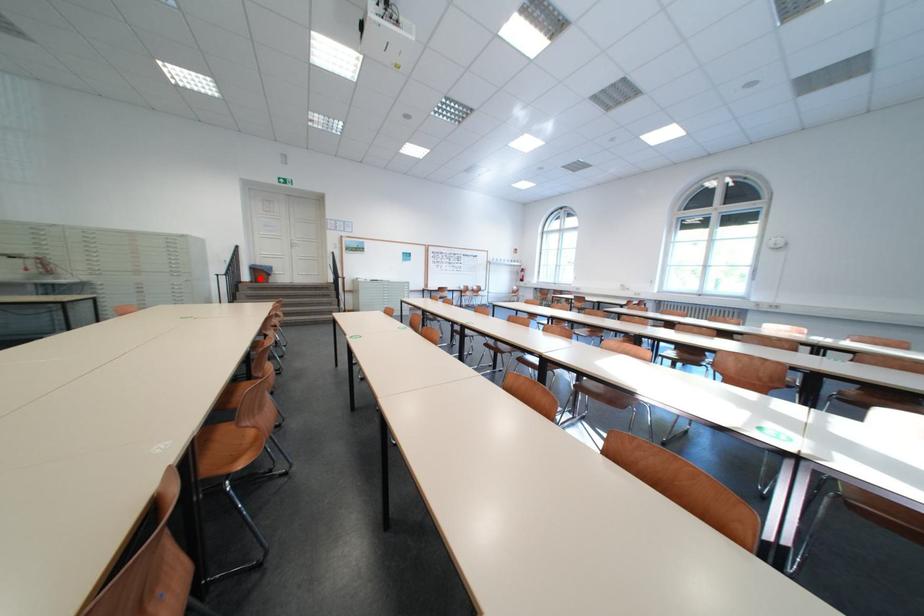
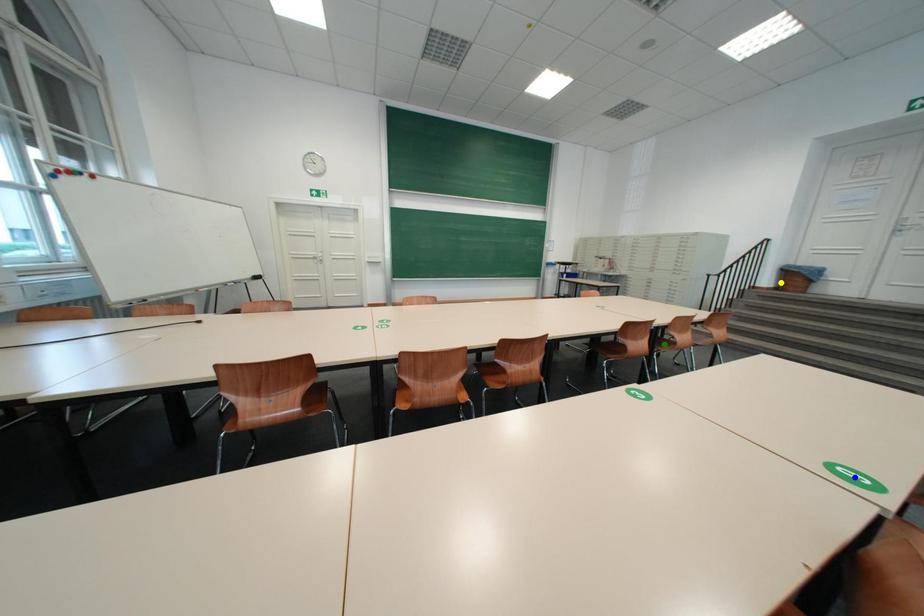
Question: I am providing you with two images of the same scene from different viewpoints. A red point is marked on the first image. You are given multiple points on the second image. Which point in image 2 is actually the same real-world point as the red point in image 1?

Choices:
 (A) yellow point
 (B) green point
 (C) blue point

Answer: (A)